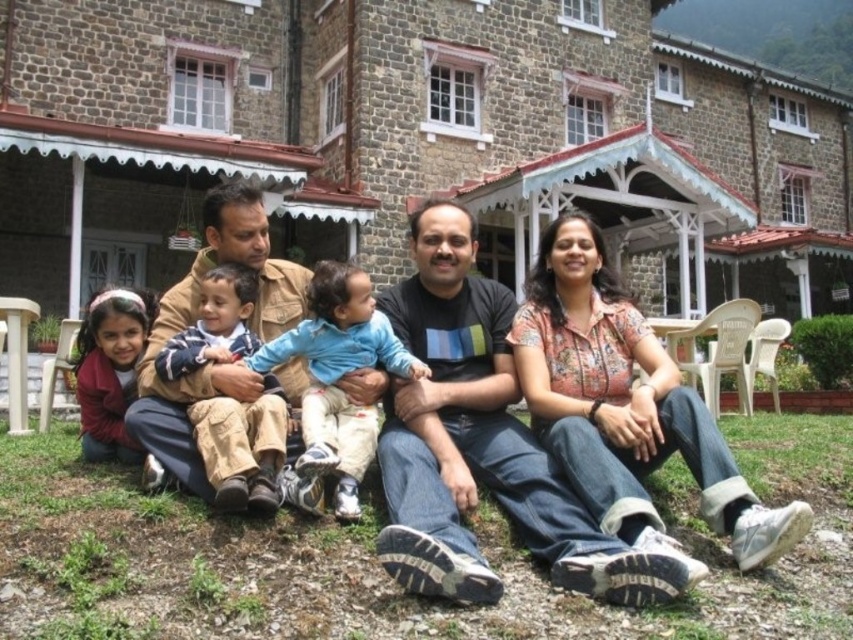
Question: Estimate the real-world distances between objects in this image. Which object is closer to the matte red sweater at lower left?

Choices:
 (A) floral print shirt at center
 (B) dark blue t-shirt at center

Answer: (B)

Question: Is floral print shirt at center above matte red sweater at lower left?

Choices:
 (A) yes
 (B) no

Answer: (A)

Question: Can you confirm if matte black shirt at center is wider than dark blue t-shirt at center?

Choices:
 (A) no
 (B) yes

Answer: (B)

Question: Among these points, which one is farthest from the camera?

Choices:
 (A) (338, 435)
 (B) (663, 420)
 (C) (235, 269)
 (D) (480, 300)

Answer: (D)

Question: Observing the image, what is the correct spatial positioning of matte black shirt at center in reference to blue cotton shirt at center?

Choices:
 (A) below
 (B) above

Answer: (A)

Question: Among these objects, which one is nearest to the camera?

Choices:
 (A) floral print shirt at center
 (B) matte black shirt at center

Answer: (A)